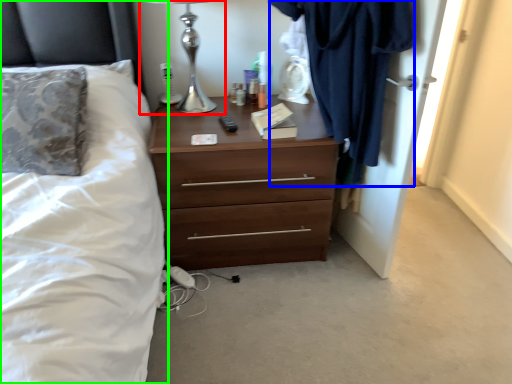
Question: Which object is the farthest from table lamp (highlighted by a red box)? Choose among these: clothing (highlighted by a blue box) or bed (highlighted by a green box).

Choices:
 (A) clothing
 (B) bed

Answer: (A)